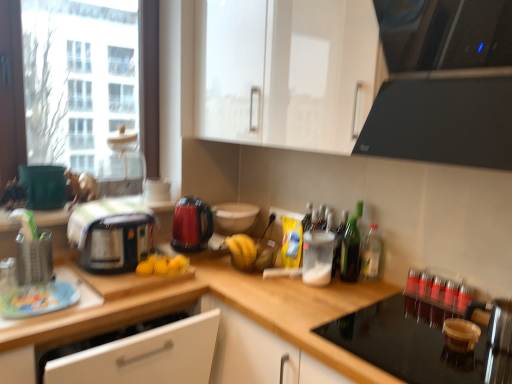
Find the location of `free space in front of clear glass bottle at right, acting as the second bottle starting from the right`. free space in front of clear glass bottle at right, acting as the second bottle starting from the right is located at coordinates (379, 294).